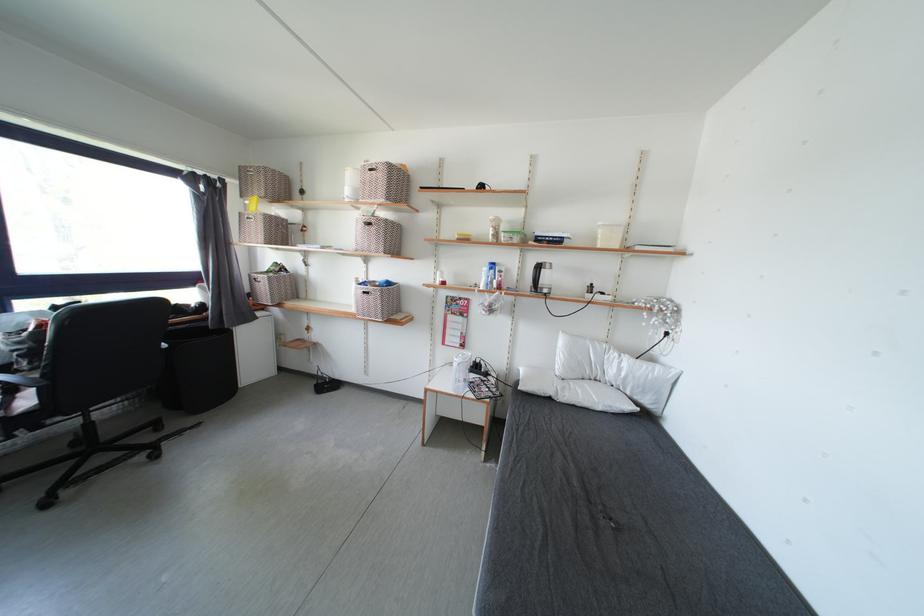
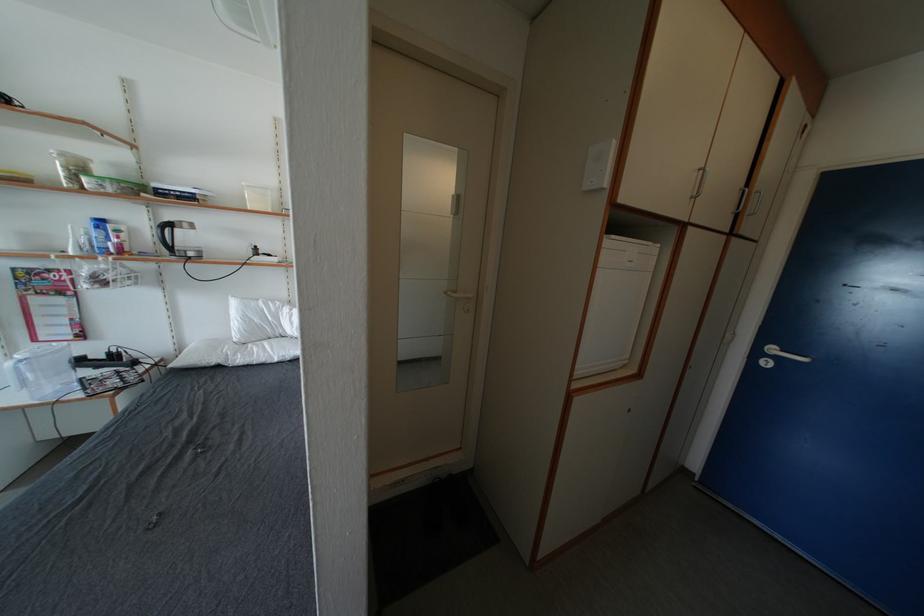
Find the pixel in the second image that matches (x=554, y=270) in the first image.

(191, 230)